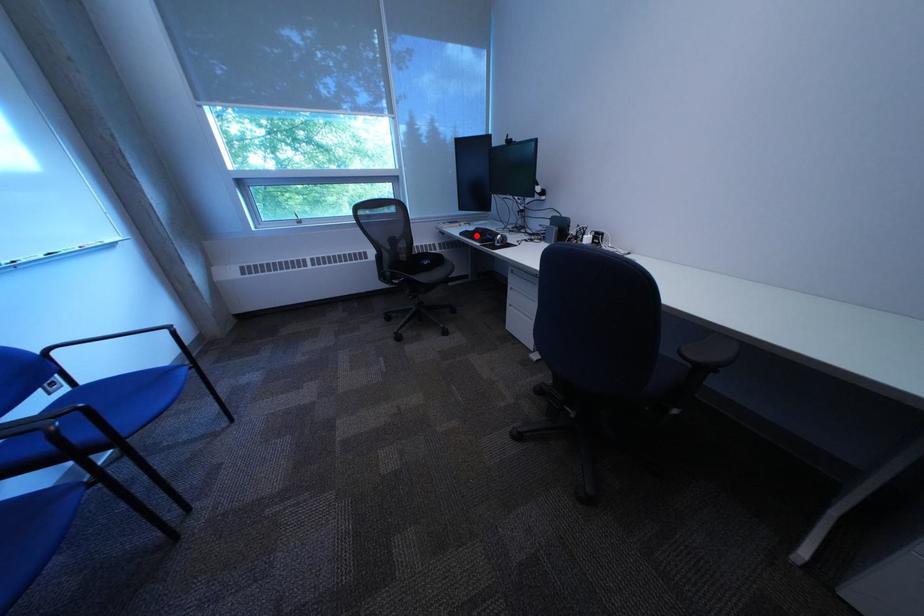
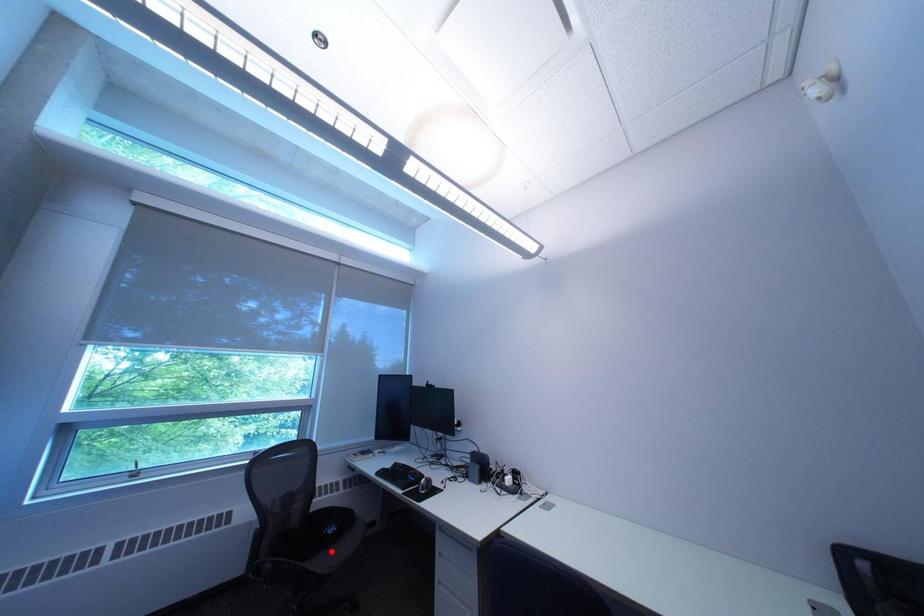
I am providing you with two images of the same scene from different viewpoints. A red point is marked on the first image and another point is marked on the second image. Does the point marked in image1 correspond to the same location as the one in image2?

No